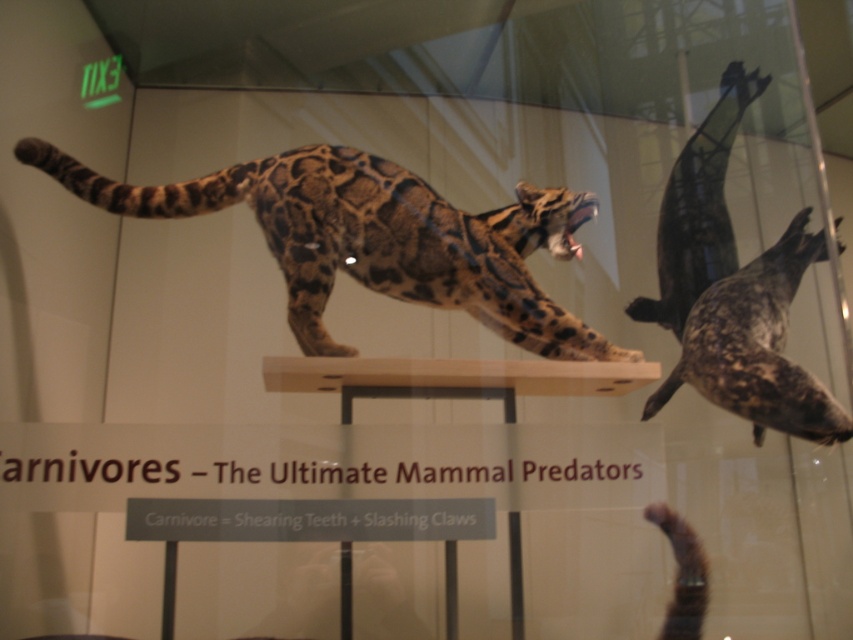
Question: Which object is the closest to the dark brown fur seal at right?

Choices:
 (A) speckled fur seal at right
 (B) spotted fur jaguar at center

Answer: (A)

Question: Is spotted fur jaguar at center to the right of speckled fur seal at right from the viewer's perspective?

Choices:
 (A) no
 (B) yes

Answer: (A)

Question: Can you confirm if speckled fur seal at right is positioned to the left of dark brown fur seal at right?

Choices:
 (A) no
 (B) yes

Answer: (B)

Question: Which point is closer to the camera?

Choices:
 (A) dark brown fur seal at right
 (B) spotted fur jaguar at center
 (C) speckled fur seal at right

Answer: (C)

Question: Does speckled fur seal at right appear under dark brown fur seal at right?

Choices:
 (A) no
 (B) yes

Answer: (B)

Question: Which object is closer to the camera taking this photo?

Choices:
 (A) spotted fur jaguar at center
 (B) speckled fur seal at right
 (C) dark brown fur seal at right

Answer: (B)